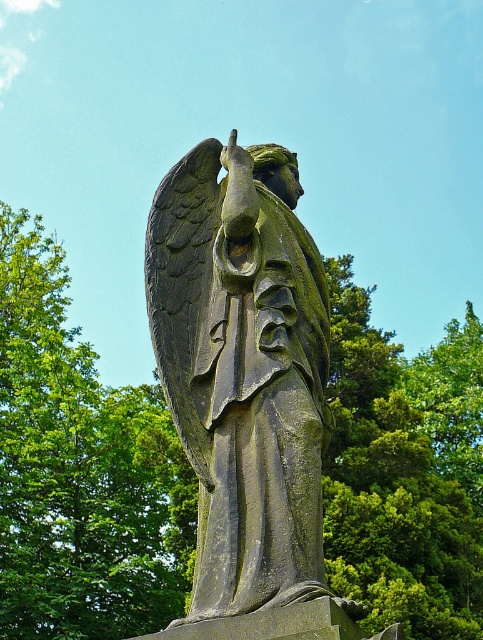
Question: Which of the following is the closest to the observer?

Choices:
 (A) green leafy tree at center
 (B) greenish stone statue at center

Answer: (B)

Question: Which point appears farthest from the camera in this image?

Choices:
 (A) (279, 452)
 (B) (127, 540)

Answer: (B)

Question: In this image, where is green leafy tree at center located relative to greenish stone statue at center?

Choices:
 (A) right
 (B) left

Answer: (A)

Question: Is green leafy tree at center bigger than greenish stone statue at center?

Choices:
 (A) no
 (B) yes

Answer: (B)

Question: Which of the following is the farthest from the observer?

Choices:
 (A) (242, 234)
 (B) (359, 465)

Answer: (B)

Question: Can you confirm if green leafy tree at center is bigger than greenish stone statue at center?

Choices:
 (A) no
 (B) yes

Answer: (B)